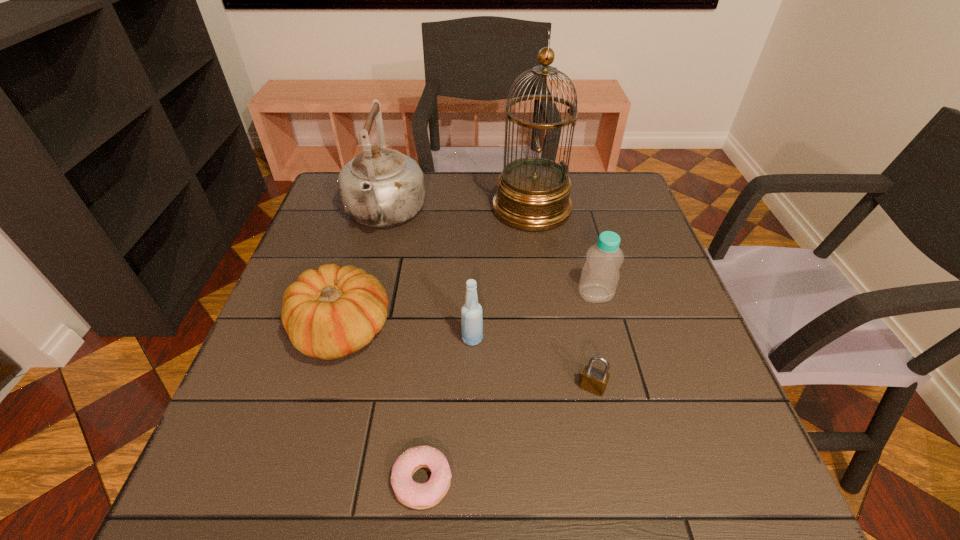
You are a GUI agent. You are given a task and a screenshot of the screen. Output one action in this format:
    pyautogui.click(x=<x>, y=<y>)
    Task: Click on the free region located 0.240m with an open door on the birdcage
    Image resolution: width=960 pixels, height=540 pixels.
    Given the screenshot: What is the action you would take?
    pyautogui.click(x=410, y=208)

The image size is (960, 540). Find the location of `vacant space located 0.250m with an open door on the birdcage`. vacant space located 0.250m with an open door on the birdcage is located at coordinates (406, 208).

The height and width of the screenshot is (540, 960). Identify the location of free point located 0.350m with an open door on the birdcage. (372, 208).

Identify the location of free space located at the spout of the sixth shortest object. (359, 313).

This screenshot has height=540, width=960. I want to click on vacant space positioned on the left of the right bottle, so click(518, 294).

This screenshot has height=540, width=960. What are the coordinates of `free spot located on the left of the nearer bottle` in the screenshot? It's located at (368, 339).

Identify the location of vacant space situated on the right of the gourd. (419, 331).

At what (x,y) coordinates should I click in order to perform the action: click on free point located 0.140m on the back of the second shortest object. Please return your answer as a coordinate pair (x, y). This screenshot has height=540, width=960. Looking at the image, I should click on (579, 323).

The height and width of the screenshot is (540, 960). I want to click on vacant area situated 0.170m on the left of the third object from left to right, so pos(289,481).

This screenshot has height=540, width=960. Find the location of `birdcage positioned at the far edge`. birdcage positioned at the far edge is located at coordinates (533, 193).